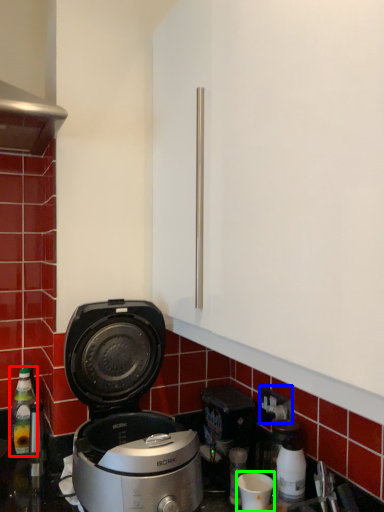
Question: Estimate the real-world distances between objects in this image. Which object is farther from bottle (highlighted by a red box), electric outlet (highlighted by a blue box) or appliance (highlighted by a green box)?

Choices:
 (A) electric outlet
 (B) appliance

Answer: (A)